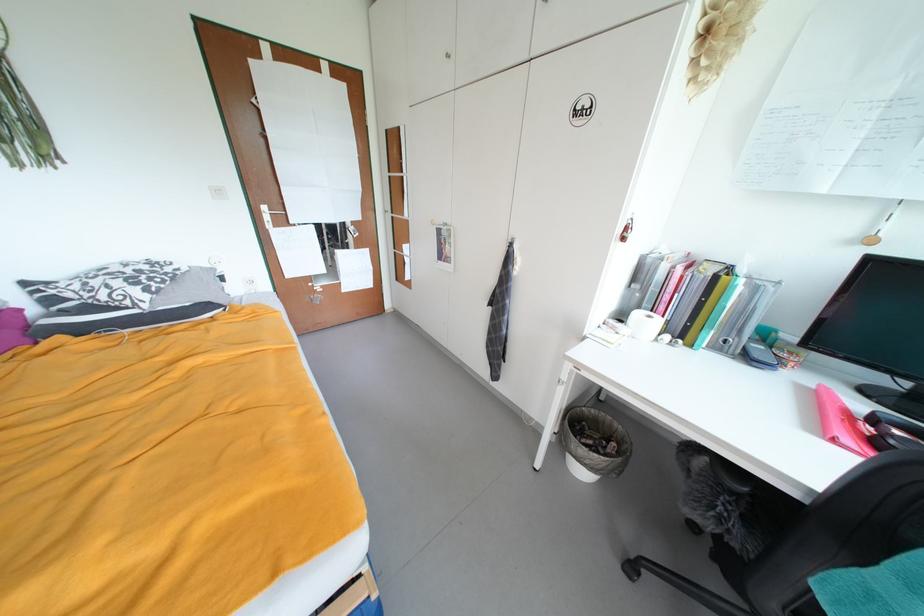
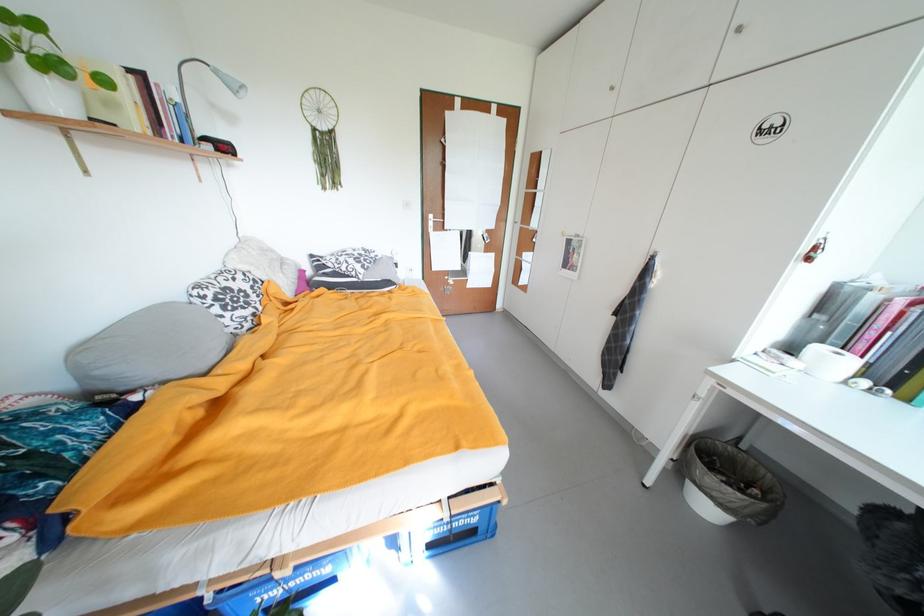
Where in the second image is the point corresponding to (657,318) from the first image?

(845, 355)